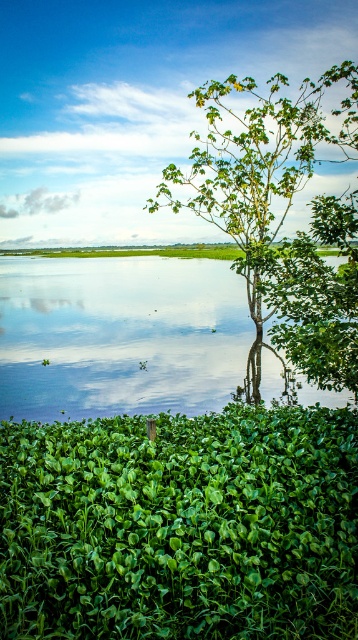
Can you confirm if transparent water at center is thinner than green leafy tree at center?

No.

Who is more distant from viewer, [272,372] or [278,96]?

The point [278,96] is behind.

Who is more forward, (51, 278) or (191, 211)?

Point (191, 211)

In order to click on transparent water at center in this screenshot , I will do `click(119, 336)`.

Who is lower down, green leafy plant at lower center or transparent water at center?

green leafy plant at lower center is below.

Can you confirm if green leafy plant at lower center is positioned above transparent water at center?

No, green leafy plant at lower center is not above transparent water at center.

Describe the element at coordinates (181, 525) in the screenshot. Image resolution: width=358 pixels, height=640 pixels. I see `green leafy plant at lower center` at that location.

Identify the location of green leafy plant at lower center. (181, 525).

Is green leafy plant at lower center wider than green leafy tree at center?

No.

Between point (2, 458) and point (228, 156), which one is positioned in front?

Point (2, 458)

Where is `green leafy plant at lower center`? green leafy plant at lower center is located at coordinates [181, 525].